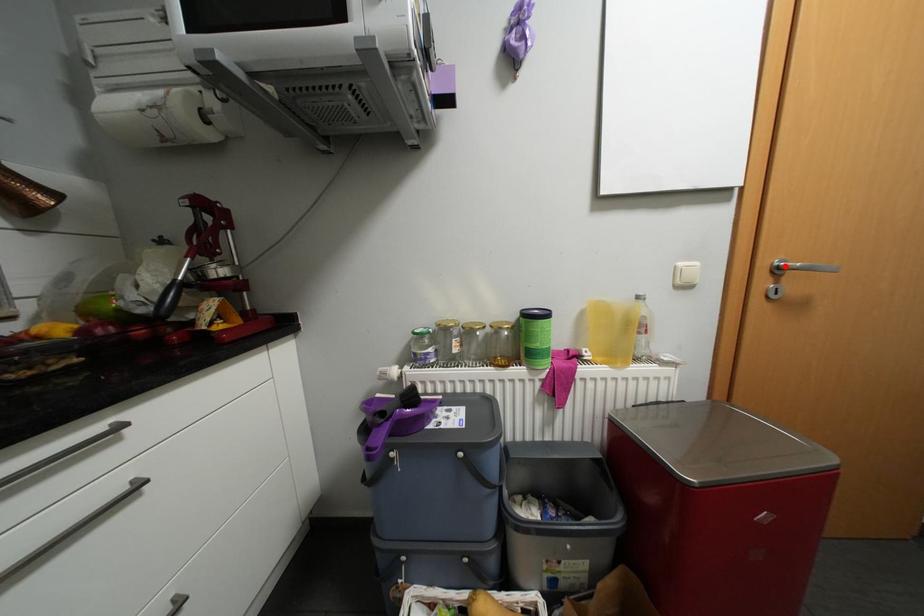
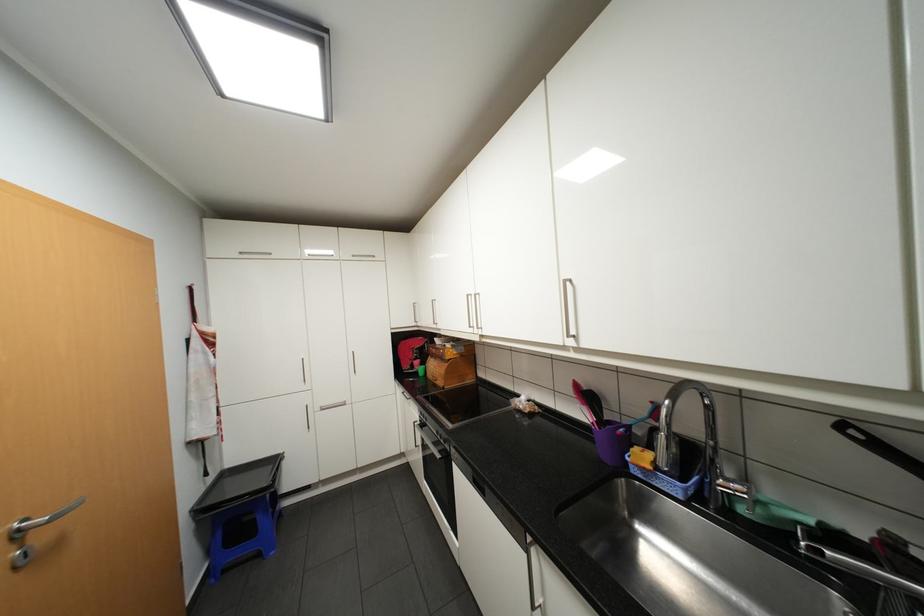
Locate, in the second image, the point that corresponds to the highlighted location in the first image.

(27, 530)